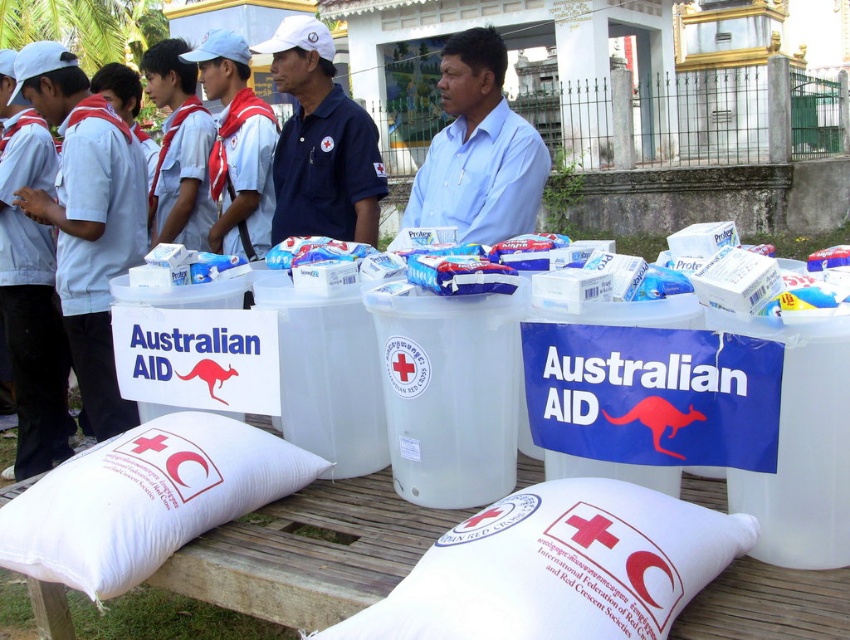
Question: Where is white fabric pillow at lower center located in relation to light blue shirt at center in the image?

Choices:
 (A) below
 (B) above

Answer: (A)

Question: Which of the following is the closest to the observer?

Choices:
 (A) (295, 184)
 (B) (77, 499)
 (C) (675, 538)
 (D) (514, 157)

Answer: (C)

Question: Is light blue shirt at center positioned before matte blue polo shirt at center?

Choices:
 (A) no
 (B) yes

Answer: (B)

Question: Which point is closer to the camera?

Choices:
 (A) white cotton shirt at center
 (B) matte blue polo shirt at center

Answer: (B)

Question: Does light blue shirt at center come in front of white cotton shirt at center?

Choices:
 (A) yes
 (B) no

Answer: (A)

Question: Which point is closer to the camera taking this photo?

Choices:
 (A) (480, 513)
 (B) (306, 99)
 (C) (222, 58)
 (D) (513, 236)

Answer: (A)